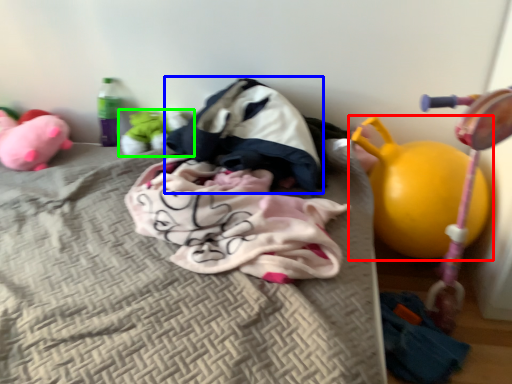
Question: Which object is positioned farthest from toy (highlighted by a red box)? Select from sleeping bag (highlighted by a blue box) and toy (highlighted by a green box).

Choices:
 (A) sleeping bag
 (B) toy

Answer: (B)